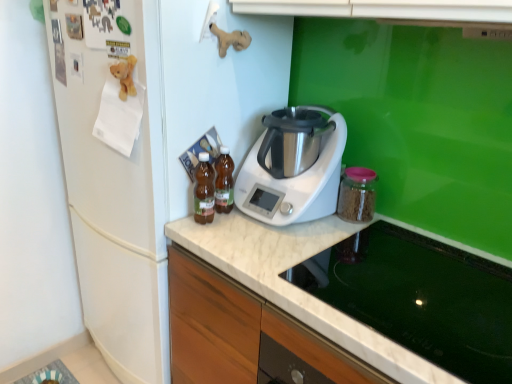
Locate an element on the screen. The width and height of the screenshot is (512, 384). vacant space to the right of translucent glass bottles at center, placed as the 3th kitchen appliance when sorted from right to left is located at coordinates (268, 226).